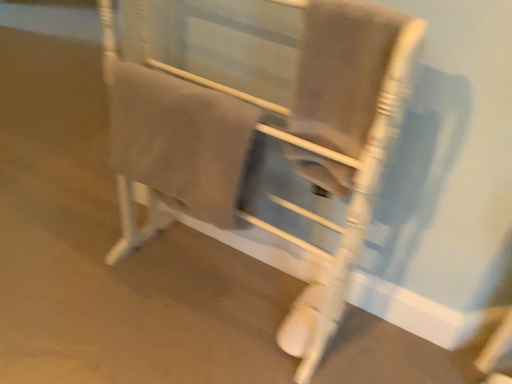
Question: From a real-world perspective, is matte white chair at center on beige cotton towel at center?

Choices:
 (A) yes
 (B) no

Answer: (B)

Question: Can you confirm if matte white chair at center is positioned to the right of beige cotton towel at center?

Choices:
 (A) no
 (B) yes

Answer: (B)

Question: Does matte white chair at center appear on the left side of beige cotton towel at center?

Choices:
 (A) yes
 (B) no

Answer: (B)

Question: Can you confirm if matte white chair at center is taller than beige cotton towel at center?

Choices:
 (A) yes
 (B) no

Answer: (A)

Question: Considering the relative sizes of matte white chair at center and beige cotton towel at center in the image provided, is matte white chair at center shorter than beige cotton towel at center?

Choices:
 (A) yes
 (B) no

Answer: (B)

Question: Is matte white chair at center far from beige cotton towel at center?

Choices:
 (A) yes
 (B) no

Answer: (B)

Question: From a real-world perspective, is beige cotton towel at center under matte white chair at center?

Choices:
 (A) yes
 (B) no

Answer: (B)

Question: Does beige cotton towel at center lie in front of matte white chair at center?

Choices:
 (A) no
 (B) yes

Answer: (A)

Question: Is beige cotton towel at center taller than matte white chair at center?

Choices:
 (A) yes
 (B) no

Answer: (B)

Question: Is matte white chair at center inside beige cotton towel at center?

Choices:
 (A) yes
 (B) no

Answer: (B)

Question: Can you confirm if beige cotton towel at center is shorter than matte white chair at center?

Choices:
 (A) no
 (B) yes

Answer: (B)

Question: Is beige cotton towel at center oriented away from matte white chair at center?

Choices:
 (A) yes
 (B) no

Answer: (A)

Question: Looking at the image, does matte white chair at center seem bigger or smaller compared to beige cotton towel at center?

Choices:
 (A) big
 (B) small

Answer: (A)